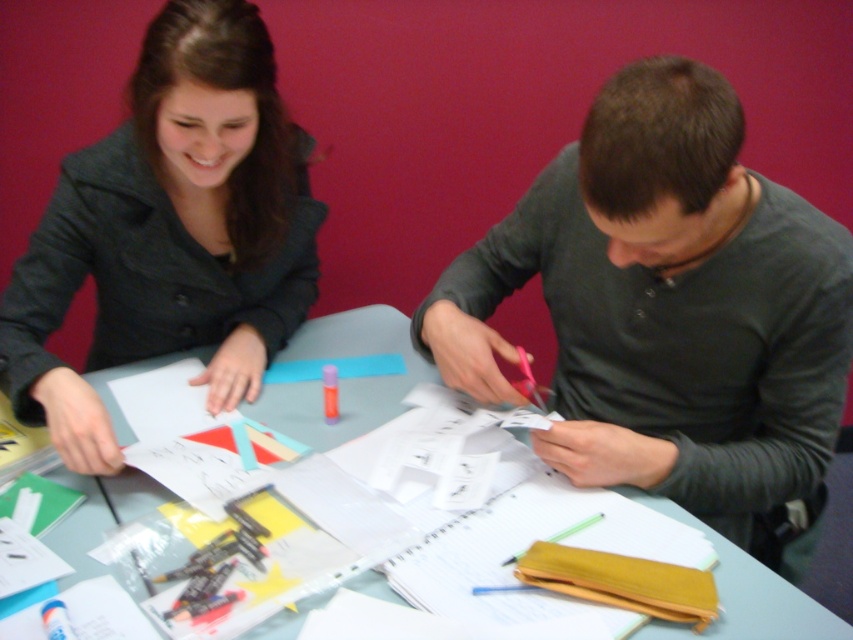
Question: Estimate the real-world distances between objects in this image. Which object is farther from the matte gray coat at upper left?

Choices:
 (A) light blue plastic table at center
 (B) dark gray shirt at center

Answer: (B)

Question: Can you confirm if matte gray coat at upper left is positioned to the left of light blue plastic table at center?

Choices:
 (A) yes
 (B) no

Answer: (A)

Question: Which point is closer to the camera taking this photo?

Choices:
 (A) (724, 572)
 (B) (297, 148)
 (C) (483, 253)

Answer: (A)

Question: Among these points, which one is farthest from the camera?

Choices:
 (A) (251, 301)
 (B) (711, 298)

Answer: (A)

Question: Does matte gray coat at upper left lie behind light blue plastic table at center?

Choices:
 (A) no
 (B) yes

Answer: (B)

Question: In this image, where is dark gray shirt at center located relative to light blue plastic table at center?

Choices:
 (A) above
 (B) below

Answer: (A)